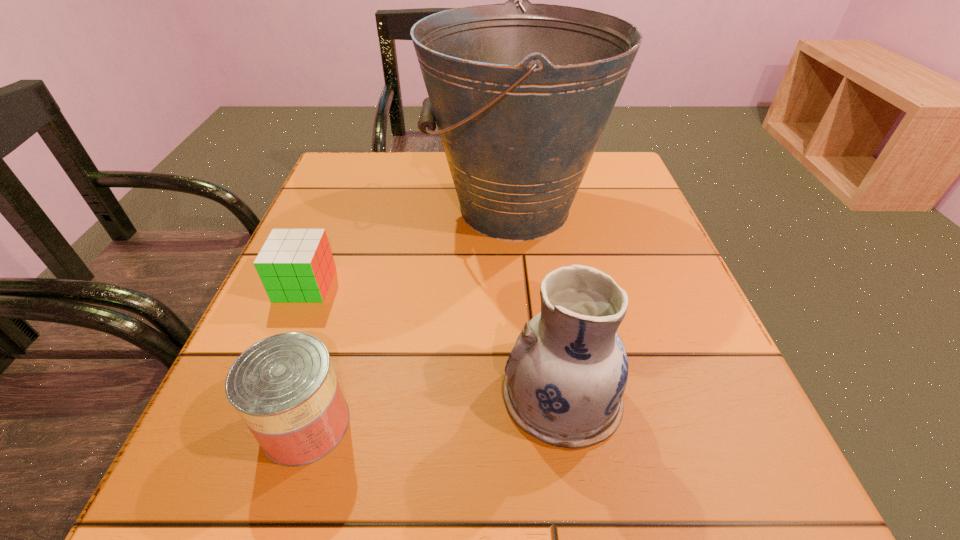
Locate an element on the screen. the farthest object is located at coordinates (521, 94).

Locate an element on the screen. Image resolution: width=960 pixels, height=540 pixels. bucket is located at coordinates (521, 94).

Where is `the third shortest object`? The width and height of the screenshot is (960, 540). the third shortest object is located at coordinates (565, 378).

This screenshot has height=540, width=960. Identify the location of can. (284, 387).

The width and height of the screenshot is (960, 540). I want to click on cube, so click(x=295, y=265).

Locate an element on the screen. the second farthest object is located at coordinates (295, 265).

The image size is (960, 540). Identify the location of vacant space located 0.190m with the handle on opposite sides of the tallest object. (344, 208).

You are a GUI agent. You are given a task and a screenshot of the screen. Output one action in this format:
    pyautogui.click(x=<x>, y=<y>)
    Task: Click on the vacant space positioned 0.120m with the handle on opposite sides of the tallest object
    
    Given the screenshot: What is the action you would take?
    pyautogui.click(x=375, y=208)

Where is `free space located with the handle on opposite sides of the tallest object`? free space located with the handle on opposite sides of the tallest object is located at coordinates 401,208.

Locate an element on the screen. Image resolution: width=960 pixels, height=540 pixels. vacant region located on the back of the pottery is located at coordinates (544, 281).